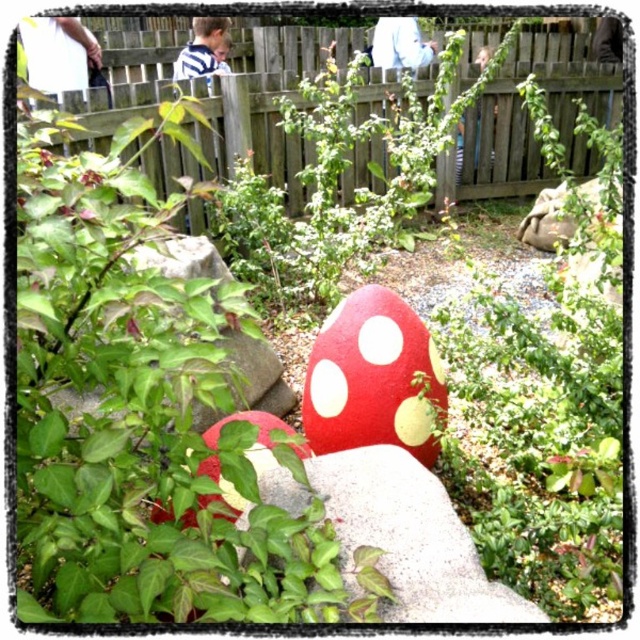
Between red matte mushroom at center and green matte rock at center-left, which one is positioned lower?

red matte mushroom at center

Is point (420, 400) closer to camera compared to point (248, 403)?

Yes, point (420, 400) is in front of point (248, 403).

This screenshot has height=640, width=640. I want to click on red matte mushroom at center, so click(x=372, y=378).

Does wooden fence at upper center have a lesser height compared to red matte mushroom at center?

Incorrect, wooden fence at upper center's height does not fall short of red matte mushroom at center's.

Who is more forward, [470,156] or [314,419]?

Point [314,419]

Measure the distance between wooden fence at upper center and camera.

They are 16.16 feet apart.

I want to click on wooden fence at upper center, so click(529, 120).

Does point (275, 58) come behind point (253, 362)?

Yes, it is.

Who is positioned more to the right, wooden fence at upper center or green matte rock at center-left?

wooden fence at upper center

Looking at this image, who is more distant from viewer, [598,77] or [214,413]?

The point [598,77] is behind.

Find the location of a particular element. Image resolution: width=640 pixels, height=640 pixels. wooden fence at upper center is located at coordinates (529, 120).